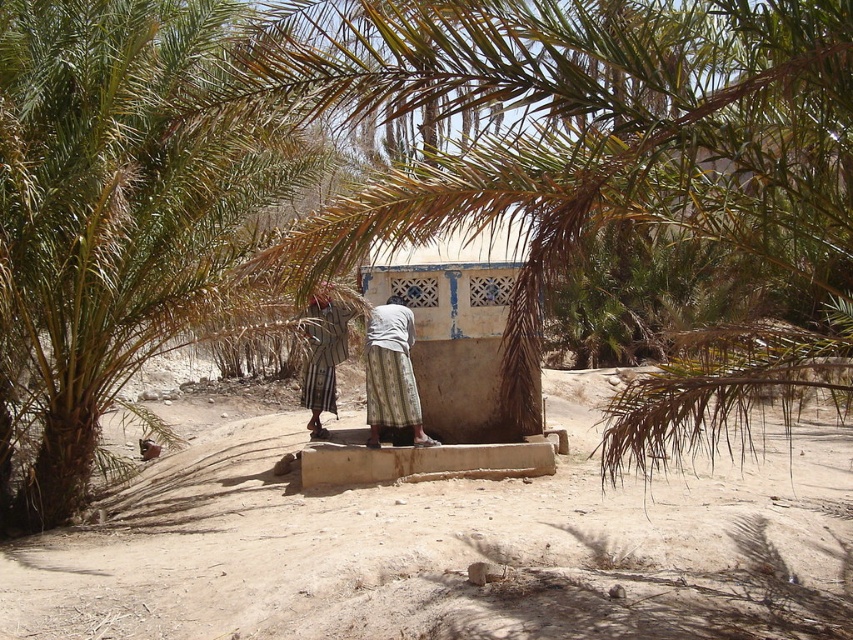
You are a hiker who needs to set up a tent. You have two options for the location based on the image provided. The first option is on the dusty sand at center, and the second is near the green leafy palm tree at left. Considering the size of the available spaces, which location would allow you to set up a larger tent?

The dusty sand at center is bigger than the green leafy palm tree at left, so the dusty sand at center would allow you to set up a larger tent because it has more space.

You are a traveler carrying a 10 feet long rope. You need to secure your belongings between the dusty sand at center and the green leafy palm tree at left. Can you do it with the rope you have?

The distance between the dusty sand at center and the green leafy palm tree at left is 10.17 feet. Since the rope is only 10 feet long, it is not long enough to secure the belongings between them.